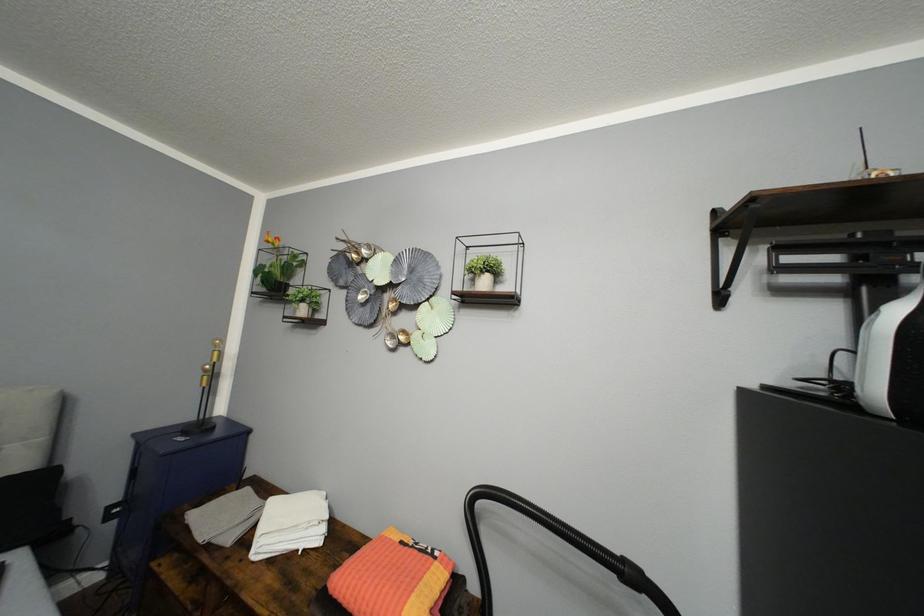
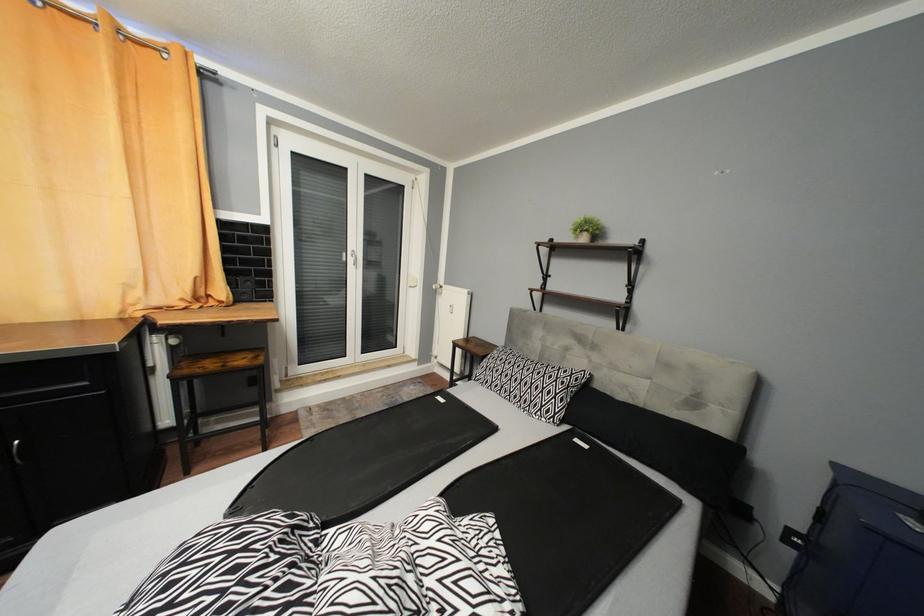
Question: The camera is either moving clockwise (left) or counter-clockwise (right) around the object. The first image is from the beginning of the video and the second image is from the end. Is the camera moving left or right when shooting the video?

Choices:
 (A) Left
 (B) Right

Answer: (B)